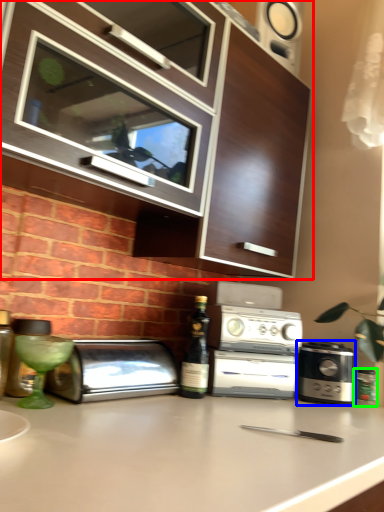
Question: Which is farther away from cabinetry (highlighted by a red box)? kitchen appliance (highlighted by a blue box) or bottle (highlighted by a green box)?

Choices:
 (A) kitchen appliance
 (B) bottle

Answer: (B)